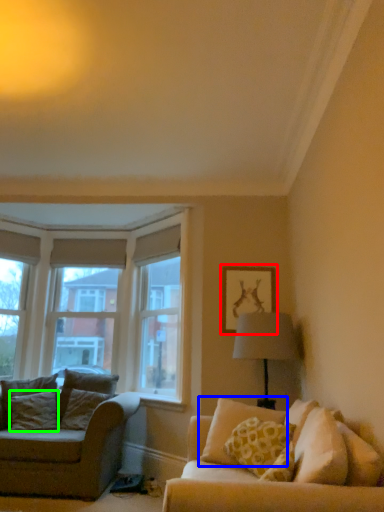
Question: Which is farther away from picture frame (highlighted by a red box)? pillow (highlighted by a blue box) or pillow (highlighted by a green box)?

Choices:
 (A) pillow
 (B) pillow

Answer: (B)